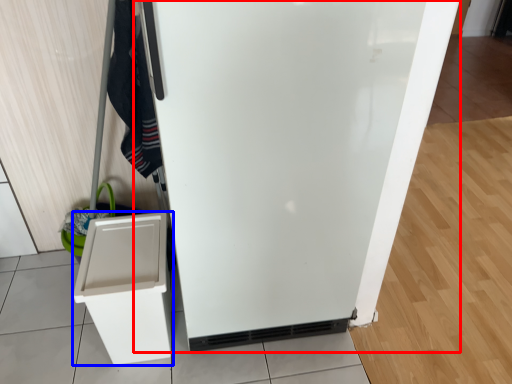
Question: Which object appears closest to the camera in this image, refrigerator (highlighted by a red box) or cabinetry (highlighted by a blue box)?

Choices:
 (A) refrigerator
 (B) cabinetry

Answer: (A)